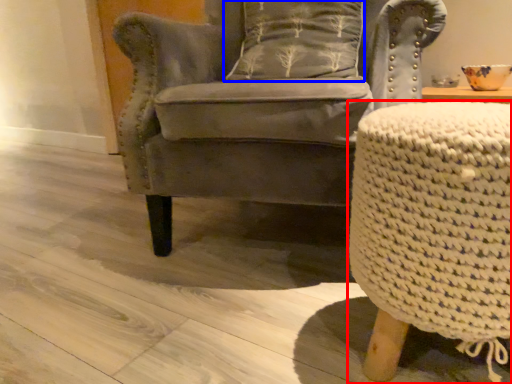
Question: Which point is closer to the camera, table (highlighted by a red box) or pillow (highlighted by a blue box)?

Choices:
 (A) table
 (B) pillow

Answer: (A)